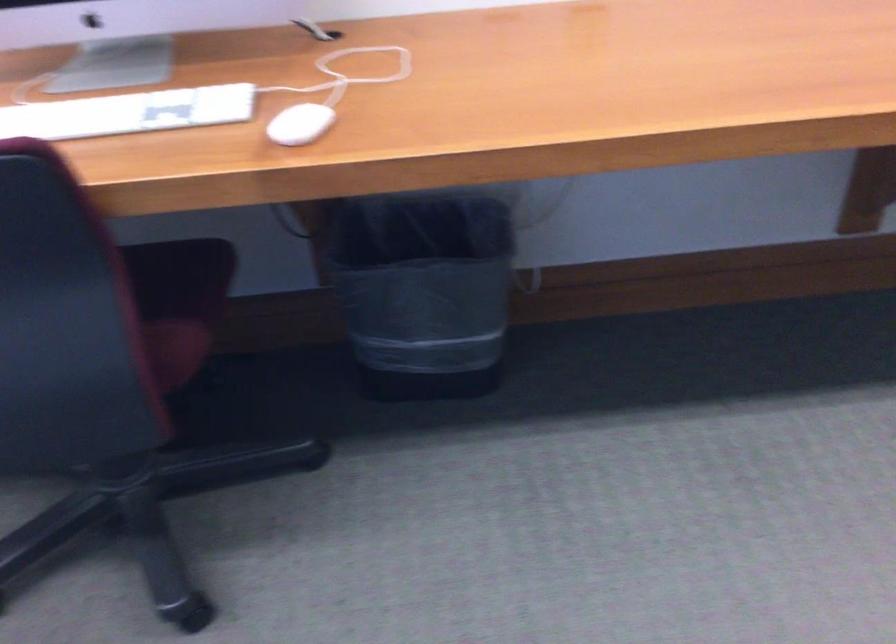
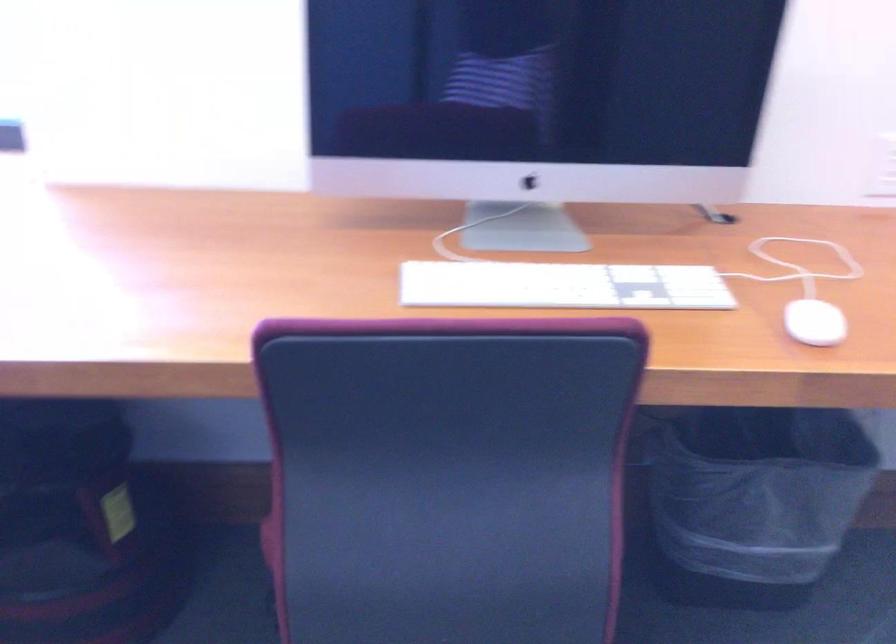
The point at (297, 126) is marked in the first image. Where is the corresponding point in the second image?

(814, 323)